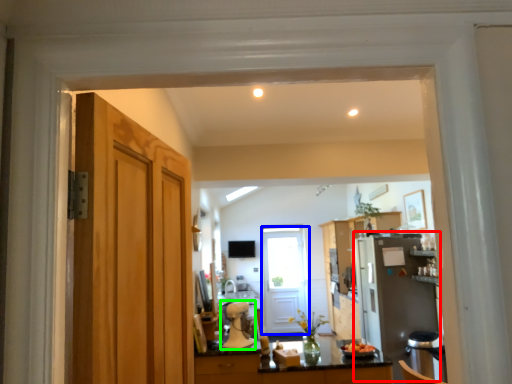
Question: Which object is positioned closest to appliance (highlighted by a red box)? Select from door (highlighted by a blue box) and appliance (highlighted by a green box).

Choices:
 (A) door
 (B) appliance

Answer: (A)